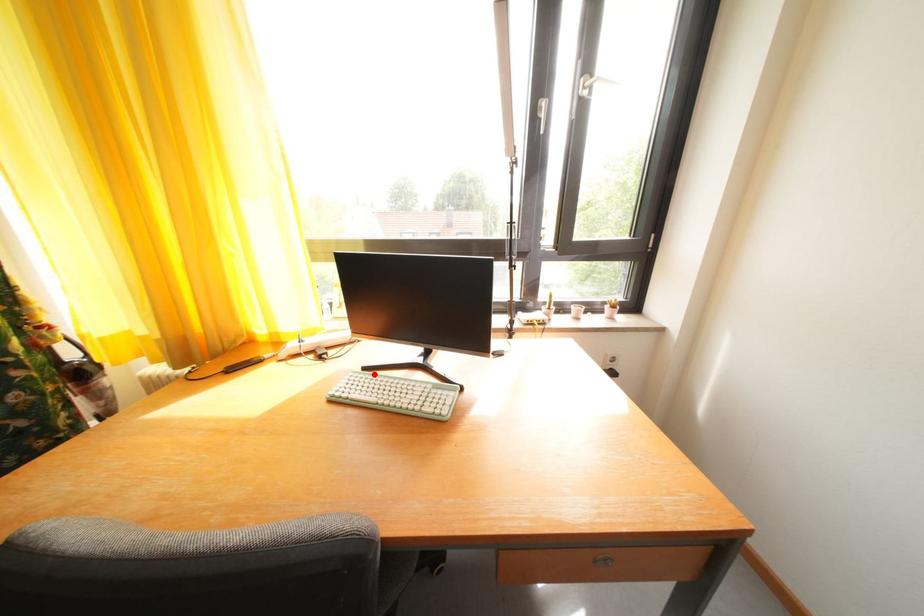
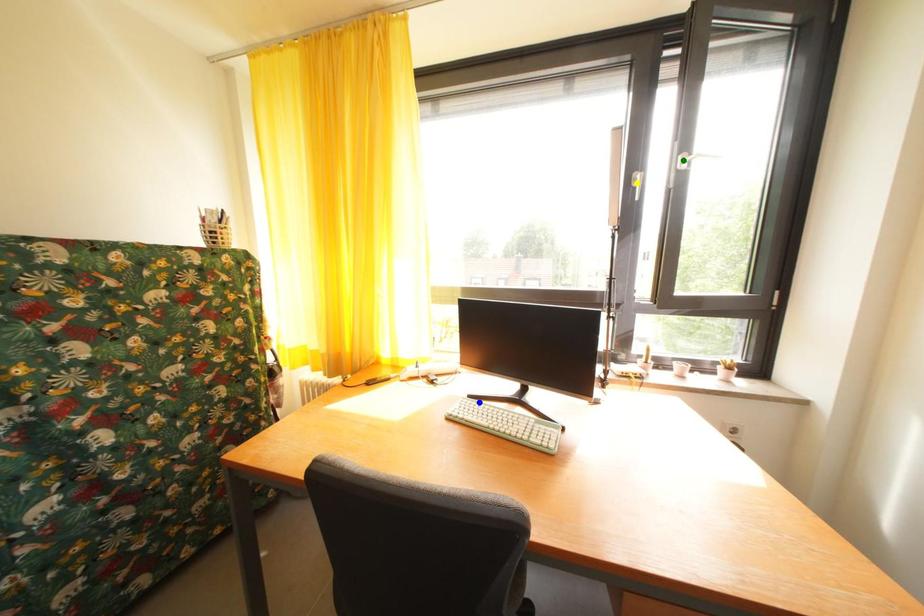
Question: I am providing you with two images of the same scene from different viewpoints. A red point is marked on the first image. You are given multiple points on the second image. Which point in image 2 represents the same 3d spot as the red point in image 1?

Choices:
 (A) yellow point
 (B) green point
 (C) blue point

Answer: (C)